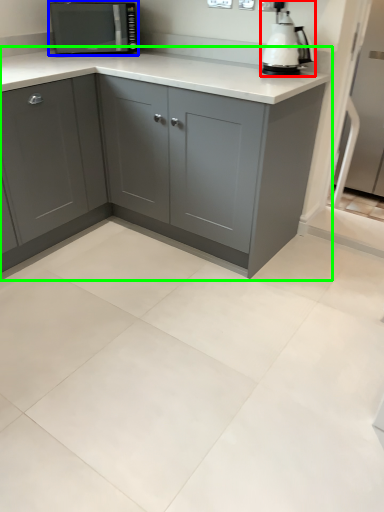
Question: Which object is positioned closest to home appliance (highlighted by a red box)? Select from kitchen appliance (highlighted by a blue box) and cabinetry (highlighted by a green box).

Choices:
 (A) kitchen appliance
 (B) cabinetry

Answer: (B)